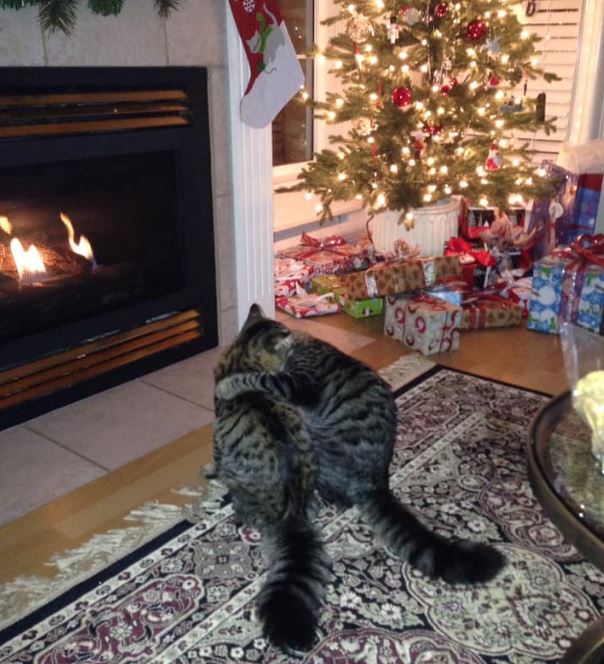
You are a GUI agent. You are given a task and a screenshot of the screen. Output one action in this format:
    pyautogui.click(x=<x>, y=<y>)
    Task: Click on the metal table frame
    Image resolution: width=604 pixels, height=664 pixels.
    Given the screenshot: What is the action you would take?
    pyautogui.click(x=572, y=534)